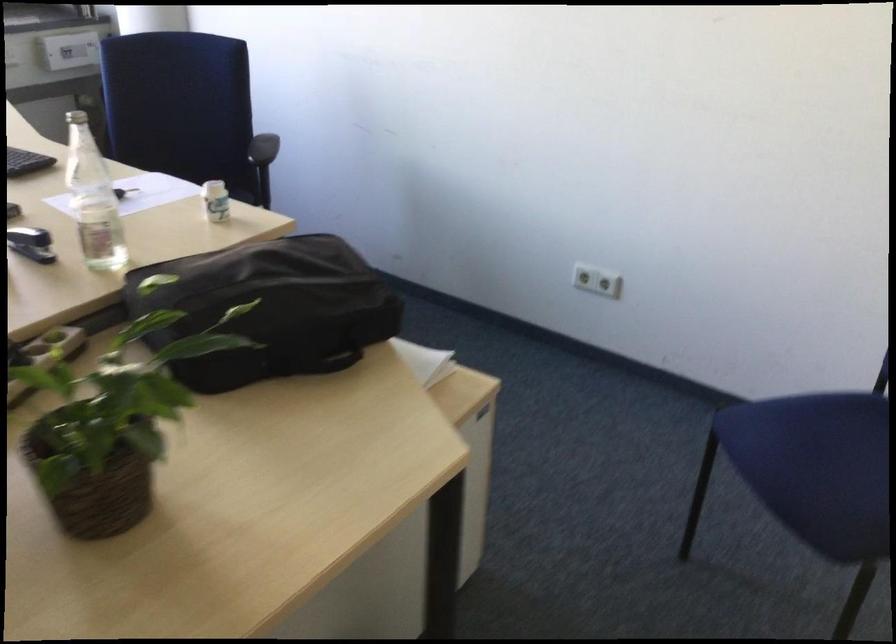
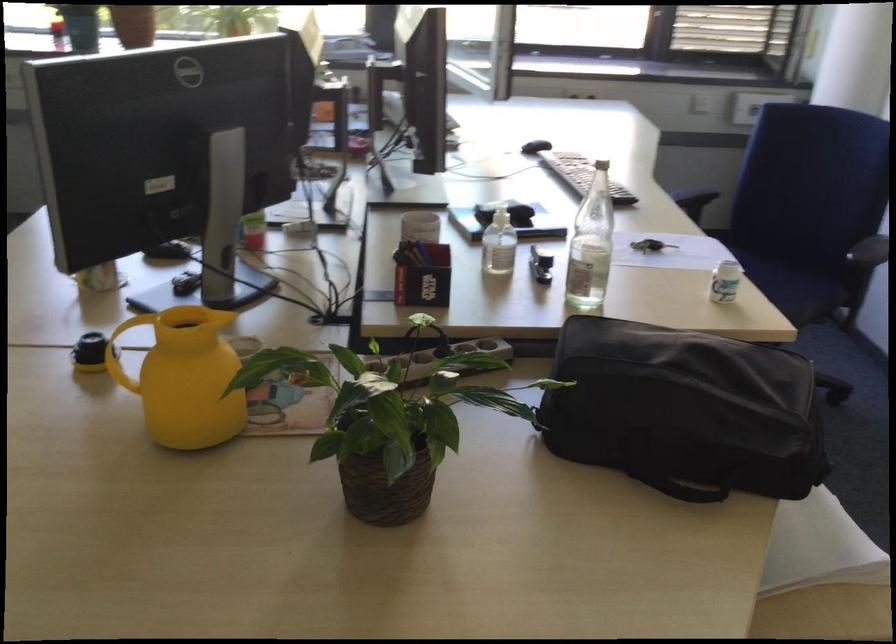
Question: The camera is either moving clockwise (left) or counter-clockwise (right) around the object. The first image is from the beginning of the video and the second image is from the end. Is the camera moving left or right when shooting the video?

Choices:
 (A) Left
 (B) Right

Answer: (B)